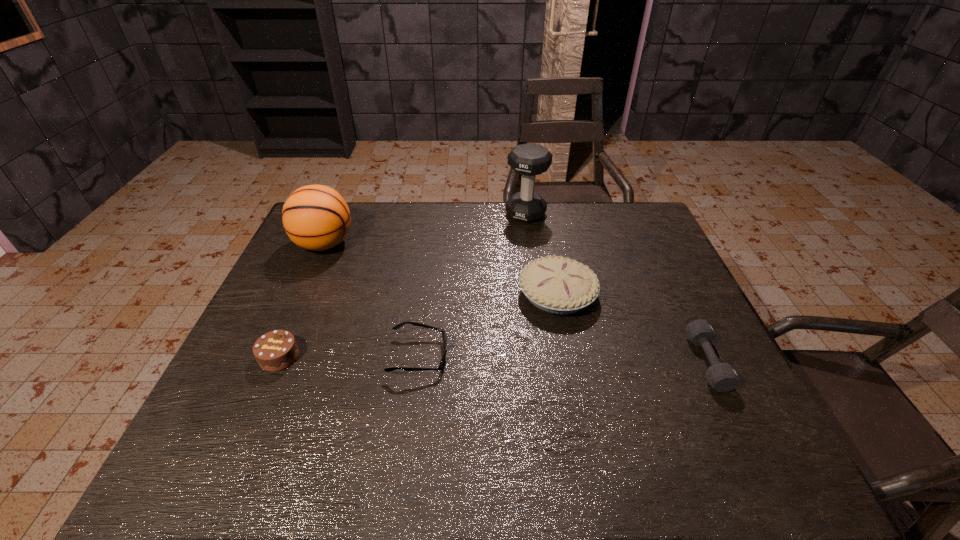
Identify the location of the tallest object. The height and width of the screenshot is (540, 960). (529, 160).

Identify the location of the taller dumbbell. (529, 160).

The height and width of the screenshot is (540, 960). Identify the location of the fifth shortest object. (315, 217).

Image resolution: width=960 pixels, height=540 pixels. I want to click on basketball, so click(x=315, y=217).

The image size is (960, 540). What are the coordinates of `the third farthest object` in the screenshot? It's located at (557, 285).

At what (x,y) coordinates should I click in order to perform the action: click on chocolate cake. Please return your answer as a coordinate pair (x, y). This screenshot has width=960, height=540. Looking at the image, I should click on (276, 350).

Where is `the shorter dumbbell`? This screenshot has height=540, width=960. the shorter dumbbell is located at coordinates (722, 377).

Locate an element on the screen. The image size is (960, 540). the rightmost object is located at coordinates (722, 377).

The height and width of the screenshot is (540, 960). In order to click on sunglasses in this screenshot , I will do `click(398, 326)`.

At what (x,y) coordinates should I click in order to perform the action: click on the shortest object. Please return your answer as a coordinate pair (x, y). Looking at the image, I should click on point(398,326).